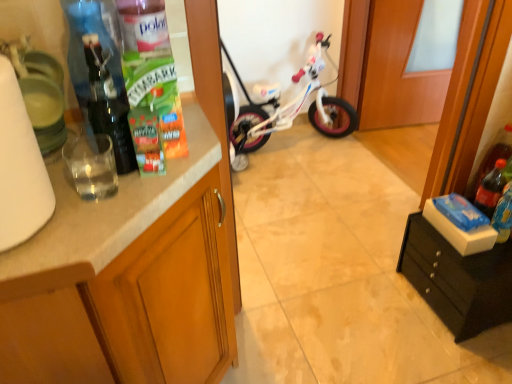
Where is `vacant area on top of white marble countertop at left (from a real-world perspective)`? This screenshot has height=384, width=512. vacant area on top of white marble countertop at left (from a real-world perspective) is located at coordinates (96, 172).